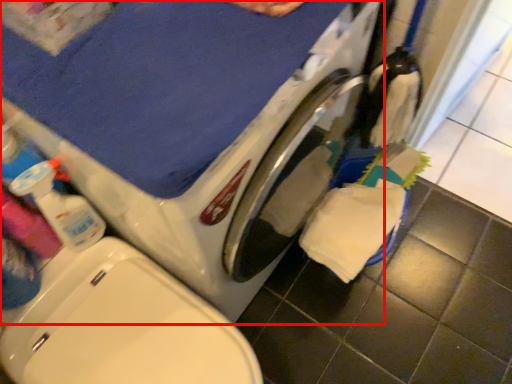
Question: From the image's perspective, what is the correct spatial relationship of washing machine (annotated by the red box) in relation to cleaning product?

Choices:
 (A) below
 (B) above

Answer: (B)